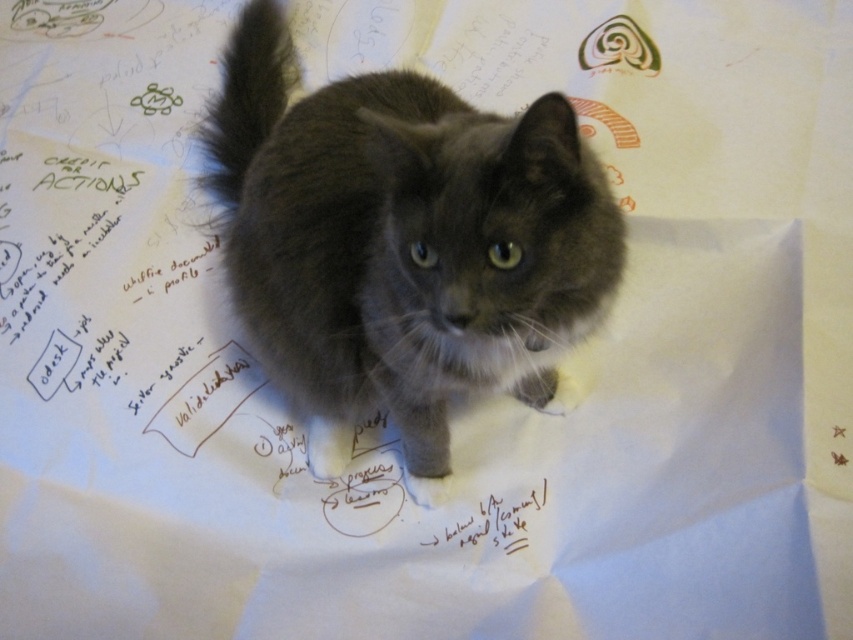
Question: Which point is farther from the camera taking this photo?

Choices:
 (A) (328, 164)
 (B) (271, 8)
 (C) (451, 506)

Answer: (B)

Question: Does gray fluffy tail at upper center appear on the left side of black paper at center?

Choices:
 (A) yes
 (B) no

Answer: (A)

Question: Estimate the real-world distances between objects in this image. Which object is farther from the gray fluffy cat at center?

Choices:
 (A) black paper at center
 (B) gray fluffy tail at upper center

Answer: (A)

Question: Is gray fluffy cat at center below black paper at center?

Choices:
 (A) no
 (B) yes

Answer: (A)

Question: Observing the image, what is the correct spatial positioning of gray fluffy cat at center in reference to black paper at center?

Choices:
 (A) below
 (B) above

Answer: (B)

Question: Which object is positioned closest to the black paper at center?

Choices:
 (A) gray fluffy cat at center
 (B) gray fluffy tail at upper center

Answer: (A)